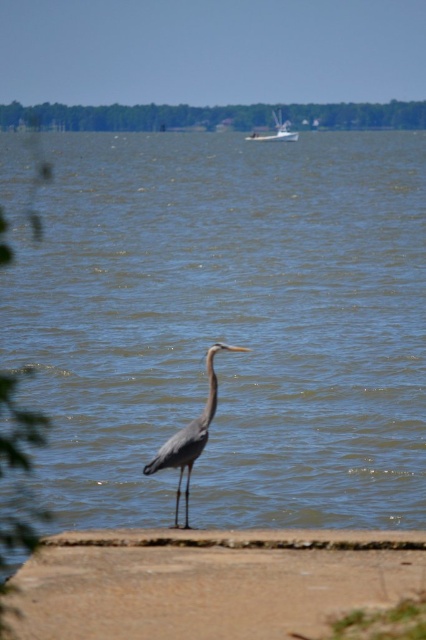
Question: Which of these objects is positioned closest to the blue water at center?

Choices:
 (A) brown sand at lower center
 (B) white glossy boat at upper center
 (C) gray matte heron at center

Answer: (A)

Question: Which object appears closest to the camera in this image?

Choices:
 (A) brown sand at lower center
 (B) blue water at center
 (C) gray matte heron at center
 (D) white glossy boat at upper center

Answer: (A)

Question: Does blue water at center lie in front of brown sand at lower center?

Choices:
 (A) yes
 (B) no

Answer: (B)

Question: Which object appears farthest from the camera in this image?

Choices:
 (A) white glossy boat at upper center
 (B) blue water at center

Answer: (A)

Question: Does blue water at center have a smaller size compared to gray matte heron at center?

Choices:
 (A) yes
 (B) no

Answer: (B)

Question: Does brown sand at lower center appear over white glossy boat at upper center?

Choices:
 (A) no
 (B) yes

Answer: (A)